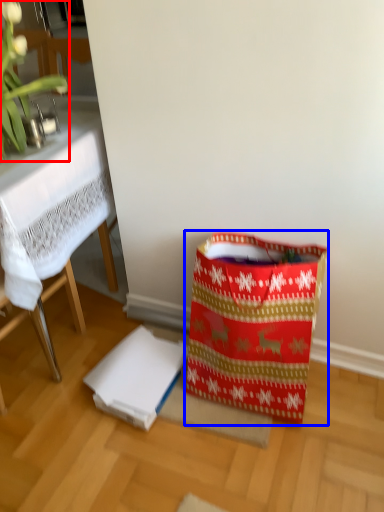
Question: Which point is further to the camera, orchid (highlighted by a red box) or shopping bag (highlighted by a blue box)?

Choices:
 (A) orchid
 (B) shopping bag

Answer: (B)